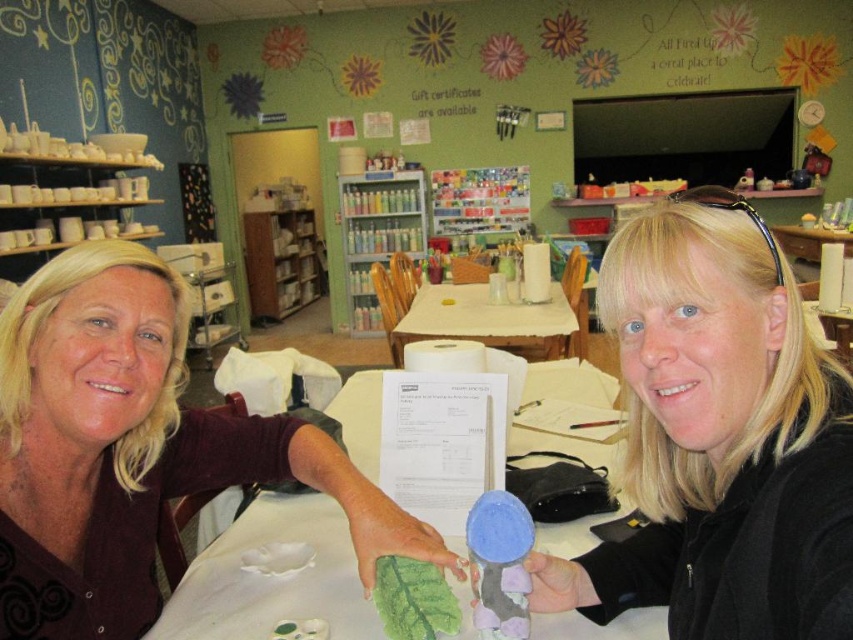
Does matte black sweater at center have a lesser height compared to metallic silver bookshelf at center?

Yes.

Is point (805, 349) closer to camera compared to point (393, 225)?

Yes, it is in front of point (393, 225).

The height and width of the screenshot is (640, 853). I want to click on matte black sweater at center, so click(x=718, y=438).

Is matte black sweater at center shorter than white fabric-covered table at center?

No, matte black sweater at center is not shorter than white fabric-covered table at center.

Which is in front, point (573, 564) or point (421, 320)?

Point (573, 564)

At what (x,y) coordinates should I click in order to perform the action: click on matte black sweater at center. Please return your answer as a coordinate pair (x, y). Looking at the image, I should click on (718, 438).

The image size is (853, 640). Describe the element at coordinates (132, 449) in the screenshot. I see `matte green clay leaf at center` at that location.

Which is in front, point (161, 324) or point (291, 241)?

Point (161, 324) is more forward.

I want to click on matte green clay leaf at center, so [x=132, y=449].